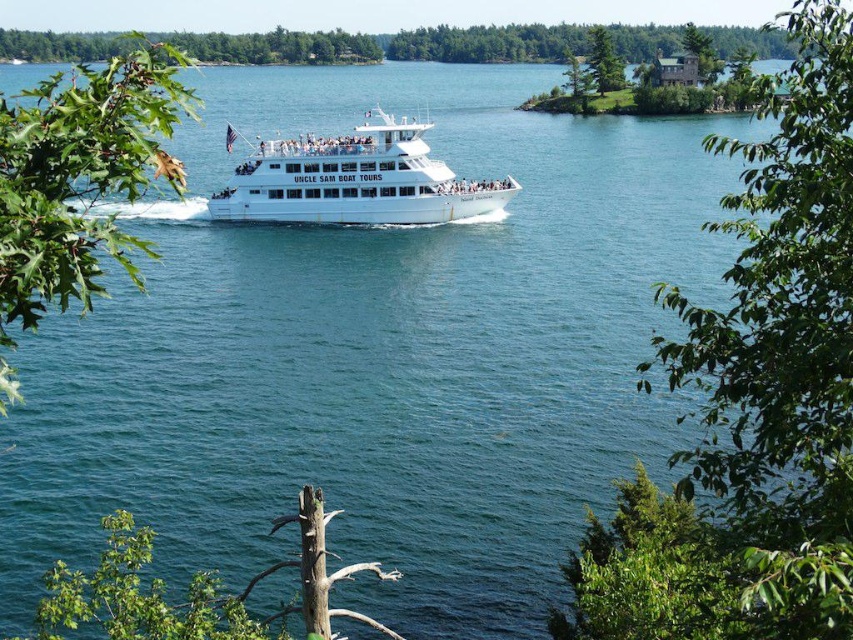
You are standing on the dock and want to take a photo of the white glossy cruise ship at center. Your camera has a maximum zoom range of 200 feet. Will you be able to capture the entire ship in your photo without moving closer?

The white glossy cruise ship at center is 255.46 feet away from the camera. Since the camera can only zoom up to 200 feet, it cannot capture the entire ship without moving closer.

You are a pilot flying a small airplane and need to land on a runway that is 100 meters long. The runway is located between the white glossy cruise ship at center and the green textured pine tree at upper center. Can your plane safely land there?

The distance between the white glossy cruise ship at center and the green textured pine tree at upper center is 85.44 meters. Since the runway is only 85.44 meters long, which is shorter than the required 100 meters, the plane cannot safely land there.

You are a photographer trying to capture the white glossy cruise ship at center and the green leafy tree at upper right in the same frame. Which object would appear bigger in your photo?

The green leafy tree at upper right would appear bigger in the photo since it has a larger size compared to the white glossy cruise ship at center.